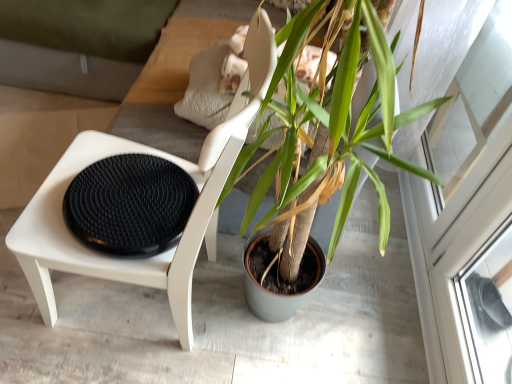
Identify the location of free location to the right of white matte chair at left. The width and height of the screenshot is (512, 384). (285, 329).